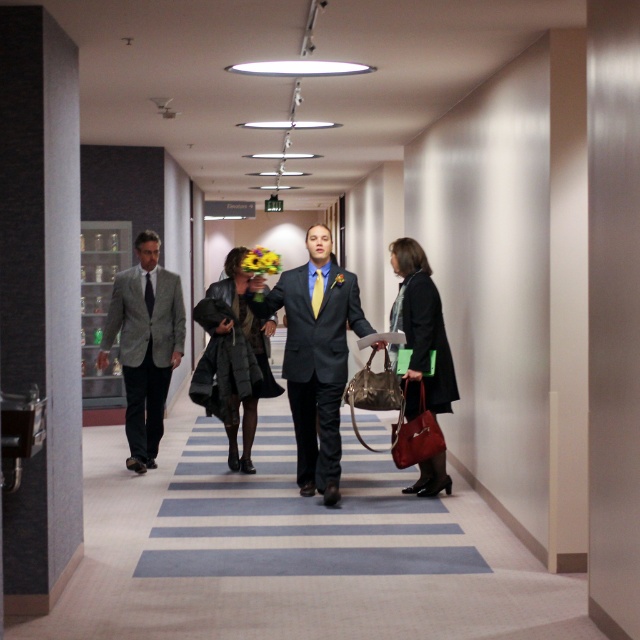
You are standing in the hallway and need to hand a document to both the person wearing the matte black suit at center and the person with the leather jacket at right. Based on their positions, which one should you approach first to ensure you can reach them without obstructing the other?

The matte black suit at center is below the leather jacket at right, so you should approach the leather jacket at right first since it is higher up and closer to your current position, allowing you to reach them without blocking the path to the other.

You are standing at the entrance of the hallway and want to take a photo of both point (138,400) and point (252,332). Which point should you focus on first to ensure both are in clear view?

You should focus on point (138,400) first because it is closer to the camera than point (252,332), ensuring both points are in clear view.

You are a security guard in the hallway and need to check both the matte black suit at center and the leather jacket at right. Which one should you check first if you want to minimize the distance you walk?

You should check the matte black suit at center first because it is closer to your starting position than the leather jacket at right, which is farther away. Since they are 36.32 inches apart, moving to the closer one first reduces the total distance walked.